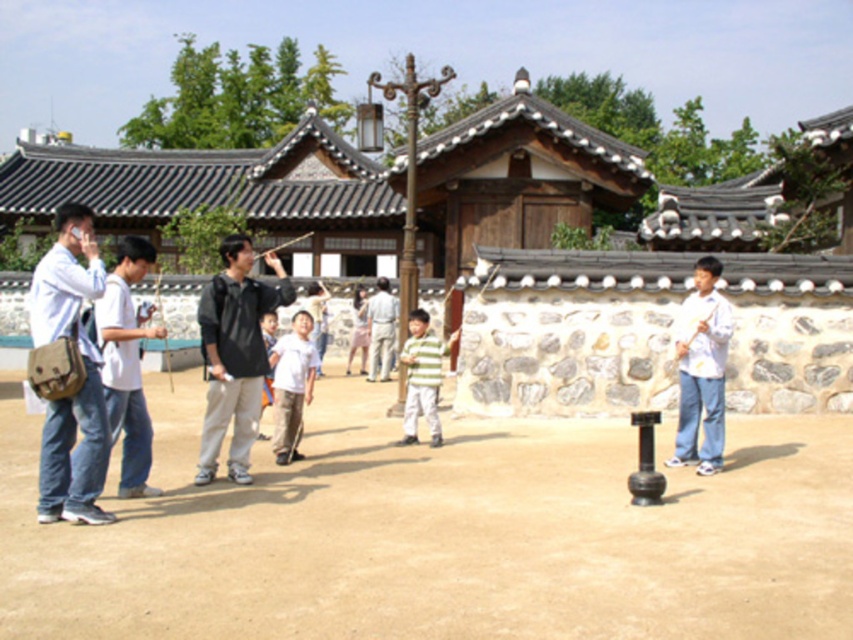
Looking at this image, you are a photographer positioned at the center of the courtyard. You want to take a photo that includes both the black matte shirt at center and the white cotton shirt at right. Given that your camera has a maximum focus range of 3 meters, will you be able to capture both subjects in focus without moving?

The distance between the black matte shirt at center and the white cotton shirt at right is 3.69 meters. Since the camera can only focus within 3 meters, the subjects are beyond the maximum focus range. Therefore, you cannot capture both in focus without moving closer or adjusting your position.

You are a photographer positioned in the courtyard and want to capture both the black matte shirt at center and the white cotton shirt at right in the same frame. Which person should you focus on first to ensure both are in the shot?

You should focus on the white cotton shirt at right first because the black matte shirt at center is located above it, so adjusting the camera angle to include the lower position first will help capture both in the frame.